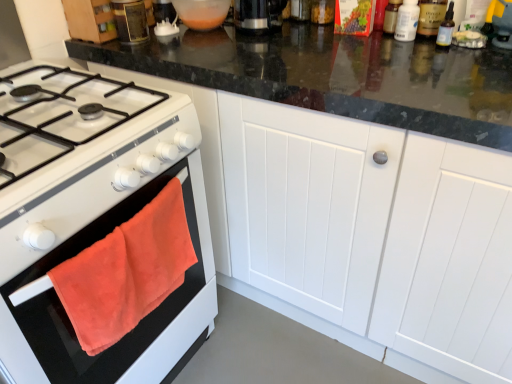
Question: Is metallic canister at upper left spatially inside translucent plastic bottle at upper right, which ranks as the 2th bottle in right-to-left order, or outside of it?

Choices:
 (A) inside
 (B) outside

Answer: (B)

Question: From the image's perspective, is metallic canister at upper left positioned above or below translucent plastic bottle at upper right, which appears as the third bottle when viewed from the left?

Choices:
 (A) above
 (B) below

Answer: (A)

Question: Which object is positioned closest to the white matte cabinet at center?

Choices:
 (A) white matte gas stove at left
 (B) metallic canister at upper left
 (C) clear glass bottle at upper right, which is counted as the 1th bottle, starting from the right
 (D) translucent plastic bottle at upper right, which ranks as the 2th bottle in right-to-left order
 (E) orange plush towel at left

Answer: (A)

Question: Which object is positioned closest to the clear glass bottle at upper right, positioned as the fourth bottle in left-to-right order?

Choices:
 (A) transparent plastic bottle at upper right, arranged as the fourth bottle when viewed from the right
 (B) white matte cabinet at center
 (C) metallic canister at upper left
 (D) black plastic coffee machine at upper center
 (E) orange plush towel at left

Answer: (A)